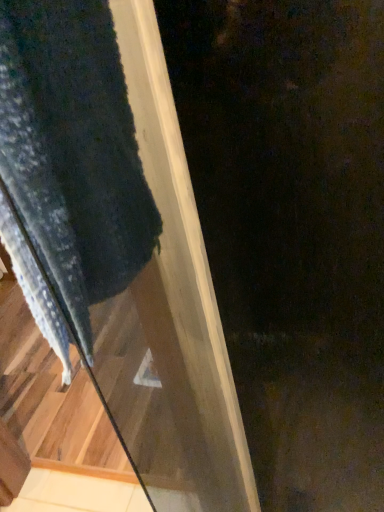
The image size is (384, 512). What do you see at coordinates (116, 247) in the screenshot?
I see `clear glass screen door at upper left` at bounding box center [116, 247].

The height and width of the screenshot is (512, 384). What are the coordinates of `clear glass screen door at upper left` in the screenshot? It's located at pos(116,247).

Find the location of a particular element. This screenshot has width=384, height=512. clear glass screen door at upper left is located at coordinates (116, 247).